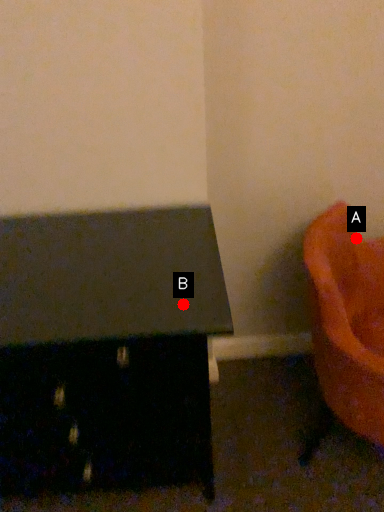
Question: Two points are circled on the image, labeled by A and B beside each circle. Which point is further to the camera?

Choices:
 (A) A is further
 (B) B is further

Answer: (A)